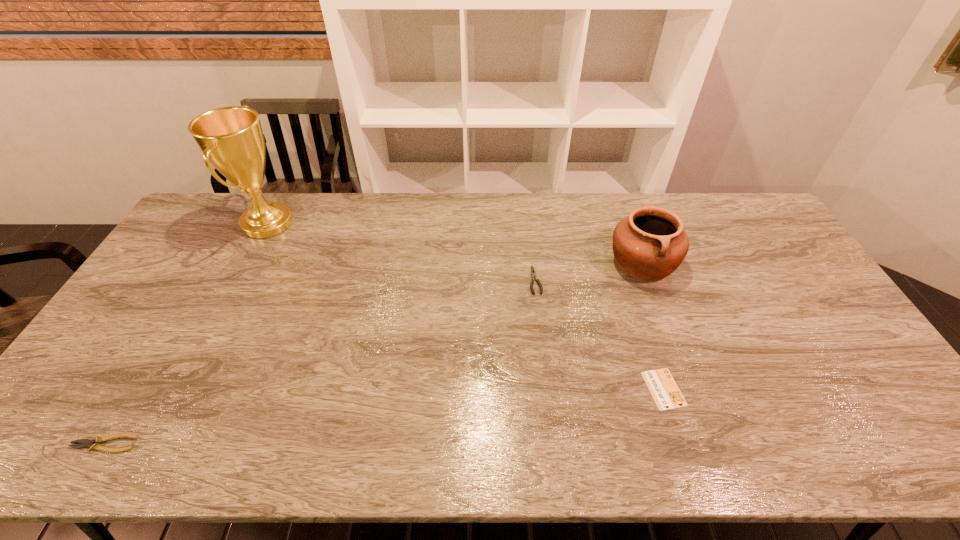
This screenshot has height=540, width=960. Find the location of `vacant space at the right edge`. vacant space at the right edge is located at coordinates (790, 272).

Locate an element on the screen. The width and height of the screenshot is (960, 540). free space at the far right corner is located at coordinates coord(745,201).

This screenshot has width=960, height=540. Find the location of `vacant area that lies between the tallest object and the farther pliers`. vacant area that lies between the tallest object and the farther pliers is located at coordinates (401, 252).

Where is `vacant area between the award and the right pliers`? This screenshot has height=540, width=960. vacant area between the award and the right pliers is located at coordinates (401, 252).

In order to click on free spot between the nearer pliers and the award in this screenshot , I will do `click(186, 334)`.

Where is `vacant area between the fourth shortest object and the right pliers`? vacant area between the fourth shortest object and the right pliers is located at coordinates (588, 272).

Where is `free space between the nearer pliers and the tallest object`? free space between the nearer pliers and the tallest object is located at coordinates (186, 334).

At what (x,y) coordinates should I click in order to perform the action: click on empty space between the right pliers and the award. Please return your answer as a coordinate pair (x, y). Looking at the image, I should click on (401, 252).

Identify the location of free point between the tallest object and the second tallest object. The image size is (960, 540). (455, 244).

Identify the location of empty location between the left pliers and the pottery. (373, 353).